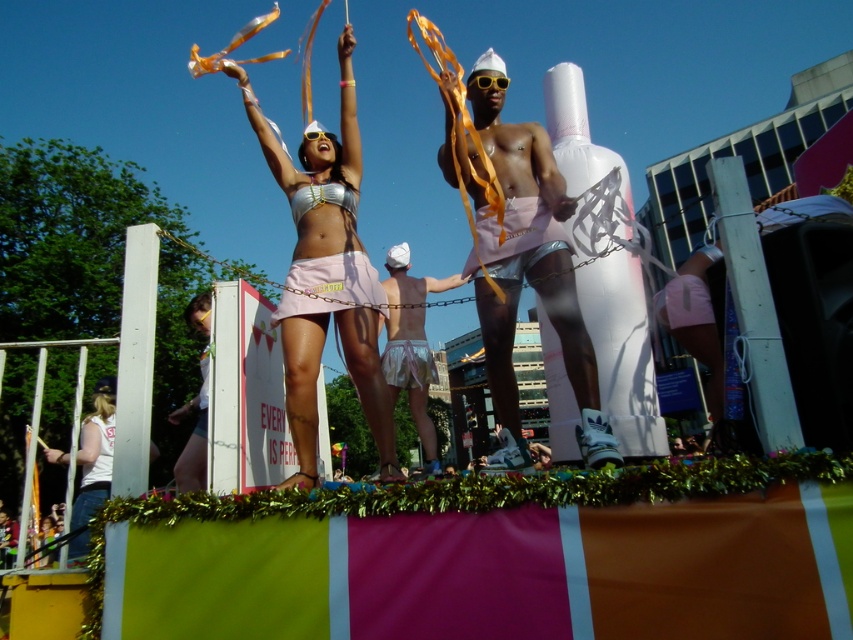
Does shiny silver bikini top at center have a larger size compared to metallic silver bikini top at center?

Indeed, shiny silver bikini top at center has a larger size compared to metallic silver bikini top at center.

Which is behind, point (360, 321) or point (328, 193)?

Point (328, 193)

Is point (292, 333) positioned behind point (294, 212)?

No, (292, 333) is in front of (294, 212).

This screenshot has height=640, width=853. In order to click on shiny silver bikini top at center in this screenshot , I will do `click(338, 333)`.

Can you confirm if pink satin skirt at center is positioned to the left of white cotton shirt at lower left?

No, pink satin skirt at center is not to the left of white cotton shirt at lower left.

Which is more to the left, pink satin skirt at center or white cotton shirt at lower left?

white cotton shirt at lower left is more to the left.

What do you see at coordinates (329, 285) in the screenshot? This screenshot has width=853, height=640. I see `pink satin skirt at center` at bounding box center [329, 285].

Locate an element on the screen. The height and width of the screenshot is (640, 853). pink satin skirt at center is located at coordinates (329, 285).

Between shiny silver bikini top at center and white satin shorts at center, which one is positioned lower?

white satin shorts at center is below.

Is shiny silver bikini top at center shorter than white satin shorts at center?

In fact, shiny silver bikini top at center may be taller than white satin shorts at center.

Which is behind, point (387, 400) or point (393, 353)?

Point (393, 353)

Find the location of a particular element. Image resolution: width=853 pixels, height=640 pixels. shiny silver bikini top at center is located at coordinates (338, 333).